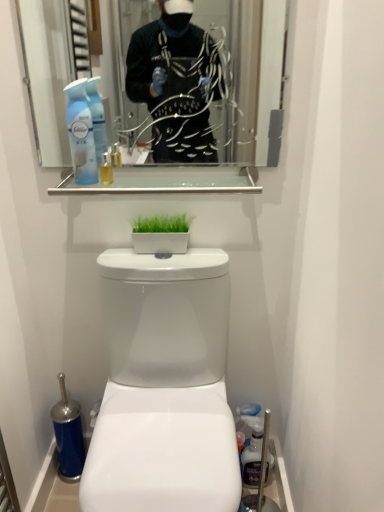
Looking at this image, what is the approximate height of clear glass mirror at upper center?

clear glass mirror at upper center is 15.71 inches in height.

This screenshot has width=384, height=512. Find the location of `clear glass mirror at upper center`. clear glass mirror at upper center is located at coordinates (201, 79).

Is translucent plastic spray bottle at upper left oriented towards clear glass shelf at upper center?

No.

Is translucent plastic spray bottle at upper left shorter than clear glass shelf at upper center?

Incorrect, the height of translucent plastic spray bottle at upper left does not fall short of that of clear glass shelf at upper center.

Is translucent plastic spray bottle at upper left far from clear glass shelf at upper center?

translucent plastic spray bottle at upper left is near clear glass shelf at upper center, not far away.

Considering the sizes of objects translucent plastic spray bottle at upper left and clear glass shelf at upper center in the image provided, who is bigger, translucent plastic spray bottle at upper left or clear glass shelf at upper center?

With larger size is translucent plastic spray bottle at upper left.

Between clear glass shelf at upper center and clear glass mirror at upper center, which one has smaller size?

clear glass shelf at upper center.

Identify the location of balustrade behind the clear glass mirror at upper center. The height and width of the screenshot is (512, 384). (167, 181).

How much distance is there between clear glass shelf at upper center and clear glass mirror at upper center?

clear glass shelf at upper center and clear glass mirror at upper center are 17.76 centimeters apart.

From their relative heights in the image, would you say clear glass shelf at upper center is taller or shorter than clear glass mirror at upper center?

clear glass shelf at upper center is shorter than clear glass mirror at upper center.

Find the location of a particular element. The width and height of the screenshot is (384, 512). toilet that appears below the translucent plastic spray bottle at upper left (from the image's perspective) is located at coordinates (164, 387).

Is white glossy toilet at center far away from translucent plastic spray bottle at upper left?

No, white glossy toilet at center is not far away from translucent plastic spray bottle at upper left.

Is point (114, 343) farther from viewer compared to point (79, 98)?

Yes, it is behind point (79, 98).

From a real-world perspective, is white glossy toilet at center under translucent plastic spray bottle at upper left?

Yes.

Considering the sizes of objects white glossy toilet at center and clear glass mirror at upper center in the image provided, who is taller, white glossy toilet at center or clear glass mirror at upper center?

white glossy toilet at center is taller.

How much distance is there between white glossy toilet at center and clear glass mirror at upper center?

They are 53.47 centimeters apart.

Between white glossy toilet at center and clear glass mirror at upper center, which one is positioned behind?

clear glass mirror at upper center is further from the camera.

From a real-world perspective, who is located higher, white glossy toilet at center or clear glass mirror at upper center?

clear glass mirror at upper center.

Which object is closer to the camera, white glossy planter at center or translucent plastic spray bottle at upper left?

translucent plastic spray bottle at upper left is more forward.

From the image's perspective, who appears lower, white glossy planter at center or translucent plastic spray bottle at upper left?

white glossy planter at center, from the image's perspective.

Looking at this image, is white glossy planter at center touching translucent plastic spray bottle at upper left?

No, white glossy planter at center is not making contact with translucent plastic spray bottle at upper left.

Is white glossy planter at center to the left of translucent plastic spray bottle at upper left from the viewer's perspective?

In fact, white glossy planter at center is to the right of translucent plastic spray bottle at upper left.

Identify the location of cleaning product lying on the left of white glossy toilet at center. (81, 133).

How many degrees apart are the facing directions of translucent plastic spray bottle at upper left and white glossy toilet at center?

They differ by 1.11 degrees in their facing directions.

Looking at the image, does translucent plastic spray bottle at upper left seem bigger or smaller compared to white glossy toilet at center?

Considering their sizes, translucent plastic spray bottle at upper left takes up less space than white glossy toilet at center.

From the image's perspective, does translucent plastic spray bottle at upper left appear higher than white glossy toilet at center?

Yes.

Are clear glass shelf at upper center and translucent plastic spray bottle at upper left located far from each other?

That's not correct — clear glass shelf at upper center is a little close to translucent plastic spray bottle at upper left.

Considering the sizes of objects clear glass shelf at upper center and translucent plastic spray bottle at upper left in the image provided, who is wider, clear glass shelf at upper center or translucent plastic spray bottle at upper left?

With larger width is clear glass shelf at upper center.

Is clear glass shelf at upper center facing towards translucent plastic spray bottle at upper left?

No, clear glass shelf at upper center is not aimed at translucent plastic spray bottle at upper left.

I want to click on balustrade that is below the translucent plastic spray bottle at upper left (from the image's perspective), so click(x=167, y=181).

Locate an element on the screen. balustrade behind the clear glass mirror at upper center is located at coordinates (167, 181).

Estimate the real-world distances between objects in this image. Which object is further from clear glass shelf at upper center, clear glass mirror at upper center or white glossy planter at center?

white glossy planter at center lies further to clear glass shelf at upper center than the other object.

In the scene shown: Based on their spatial positions, is white glossy toilet at center or clear glass mirror at upper center closer to white glossy planter at center?

white glossy toilet at center is positioned closer to the anchor white glossy planter at center.

Which object lies further to the anchor point clear glass shelf at upper center, clear glass mirror at upper center or translucent plastic spray bottle at upper left?

The object further to clear glass shelf at upper center is clear glass mirror at upper center.

Looking at the image, which one is located closer to clear glass shelf at upper center, translucent plastic spray bottle at upper left or white glossy planter at center?

translucent plastic spray bottle at upper left is closer to clear glass shelf at upper center.

Considering their positions, is translucent plastic spray bottle at upper left positioned closer to white glossy planter at center than clear glass shelf at upper center?

clear glass shelf at upper center is closer to white glossy planter at center.

From the image, which object appears to be nearer to clear glass shelf at upper center, white glossy planter at center or translucent plastic spray bottle at upper left?

translucent plastic spray bottle at upper left lies closer to clear glass shelf at upper center than the other object.

Estimate the real-world distances between objects in this image. Which object is further from translucent plastic spray bottle at upper left, white glossy toilet at center or white glossy planter at center?

white glossy toilet at center is further to translucent plastic spray bottle at upper left.

From the picture: Which object lies nearer to the anchor point clear glass shelf at upper center, translucent plastic spray bottle at upper left or clear glass mirror at upper center?

translucent plastic spray bottle at upper left is positioned closer to the anchor clear glass shelf at upper center.

Find the location of a particular element. balustrade that lies between translucent plastic spray bottle at upper left and white glossy planter at center from top to bottom is located at coordinates (167, 181).

Locate an element on the screen. balustrade between translucent plastic spray bottle at upper left and white glossy toilet at center from top to bottom is located at coordinates click(x=167, y=181).

In order to click on balustrade between clear glass mirror at upper center and white glossy toilet at center from top to bottom in this screenshot , I will do `click(167, 181)`.

Find the location of a particular element. The image size is (384, 512). balustrade between clear glass mirror at upper center and white glossy planter at center in the vertical direction is located at coordinates (167, 181).